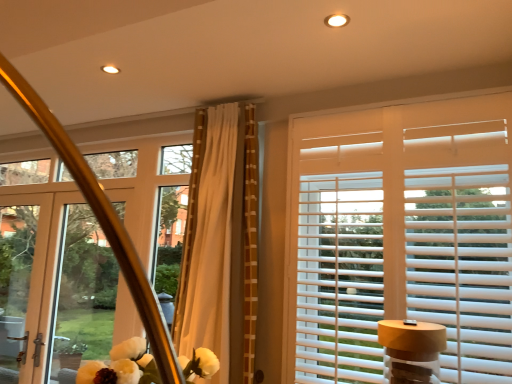
I want to click on blank space situated above beige textured curtain at center (from a real-world perspective), so click(215, 89).